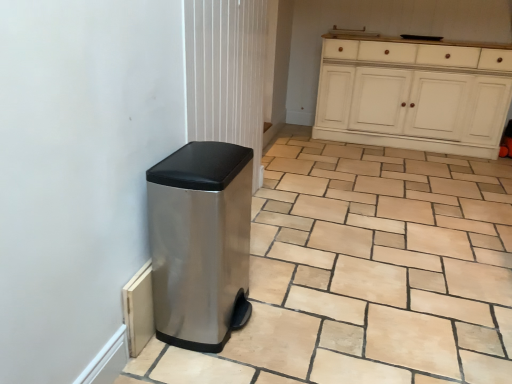
Question: Does polished stainless steel trash can at lower left have a greater width compared to white painted wood cabinet at upper right?

Choices:
 (A) yes
 (B) no

Answer: (B)

Question: Is polished stainless steel trash can at lower left not inside white painted wood cabinet at upper right?

Choices:
 (A) no
 (B) yes

Answer: (B)

Question: From the image's perspective, is polished stainless steel trash can at lower left over white painted wood cabinet at upper right?

Choices:
 (A) no
 (B) yes

Answer: (A)

Question: From a real-world perspective, is polished stainless steel trash can at lower left over white painted wood cabinet at upper right?

Choices:
 (A) yes
 (B) no

Answer: (B)

Question: Is polished stainless steel trash can at lower left at the right side of white painted wood cabinet at upper right?

Choices:
 (A) no
 (B) yes

Answer: (A)

Question: Relative to polished stainless steel trash can at lower left, is white painted wood cabinet at upper right in front or behind?

Choices:
 (A) front
 (B) behind

Answer: (B)

Question: From their relative heights in the image, would you say white painted wood cabinet at upper right is taller or shorter than polished stainless steel trash can at lower left?

Choices:
 (A) tall
 (B) short

Answer: (A)

Question: Is point (361, 49) positioned closer to the camera than point (185, 264)?

Choices:
 (A) closer
 (B) farther

Answer: (B)

Question: Based on their positions, is white painted wood cabinet at upper right located to the left or right of polished stainless steel trash can at lower left?

Choices:
 (A) left
 (B) right

Answer: (B)

Question: Visually, is polished stainless steel trash can at lower left positioned to the left or to the right of beige stone tile at lower center?

Choices:
 (A) right
 (B) left

Answer: (B)

Question: Which is correct: polished stainless steel trash can at lower left is inside beige stone tile at lower center, or outside of it?

Choices:
 (A) inside
 (B) outside

Answer: (B)

Question: From the image's perspective, is polished stainless steel trash can at lower left positioned above or below beige stone tile at lower center?

Choices:
 (A) above
 (B) below

Answer: (B)

Question: In terms of size, does polished stainless steel trash can at lower left appear bigger or smaller than beige stone tile at lower center?

Choices:
 (A) small
 (B) big

Answer: (A)

Question: Considering the positions of beige stone tile at lower center and polished stainless steel trash can at lower left in the image, is beige stone tile at lower center wider or thinner than polished stainless steel trash can at lower left?

Choices:
 (A) thin
 (B) wide

Answer: (B)

Question: From their relative heights in the image, would you say beige stone tile at lower center is taller or shorter than polished stainless steel trash can at lower left?

Choices:
 (A) tall
 (B) short

Answer: (B)